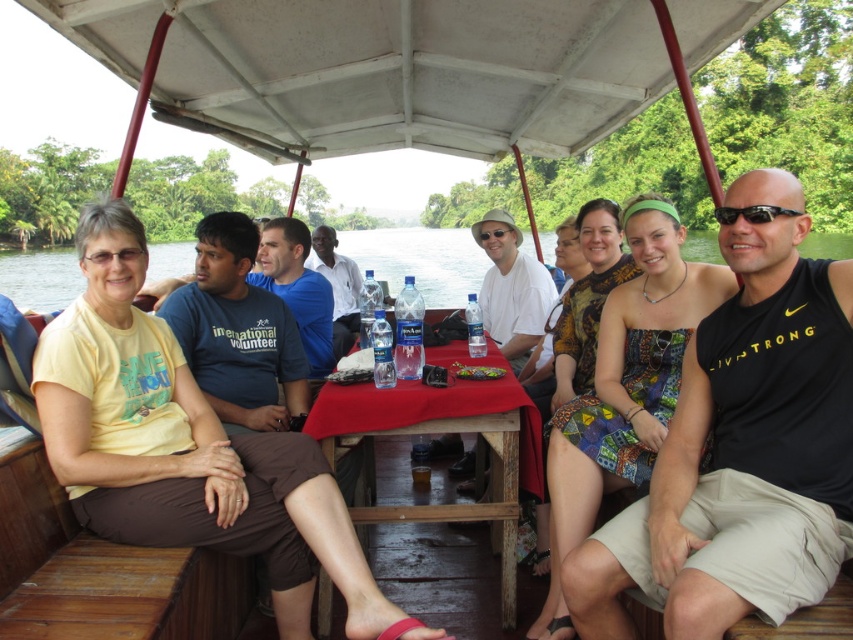
Question: Is matte blue t-shirt at center above black plastic sunglasses at right?

Choices:
 (A) yes
 (B) no

Answer: (B)

Question: Is red cloth-covered table at center positioned before blue cotton shirt at center?

Choices:
 (A) no
 (B) yes

Answer: (B)

Question: Which point is closer to the camera taking this photo?

Choices:
 (A) tap(167, 404)
 (B) tap(670, 476)
 (C) tap(511, 365)
 (D) tap(258, 280)

Answer: (B)

Question: From the image, what is the correct spatial relationship of matte blue t-shirt at center in relation to blue cotton shirt at center?

Choices:
 (A) above
 (B) below

Answer: (B)

Question: Which object appears farthest from the camera in this image?

Choices:
 (A) matte blue t-shirt at center
 (B) white matte shirt at center
 (C) black tank top at right
 (D) blue cotton shirt at center

Answer: (B)

Question: Which object is the farthest from the black plastic sunglasses at right?

Choices:
 (A) red cloth-covered table at center
 (B) white matte shirt at center

Answer: (B)